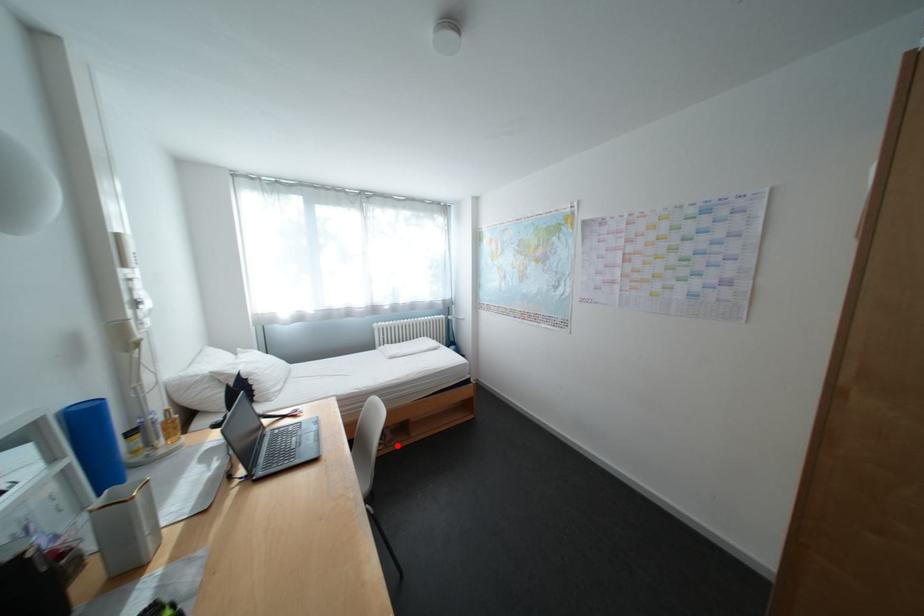
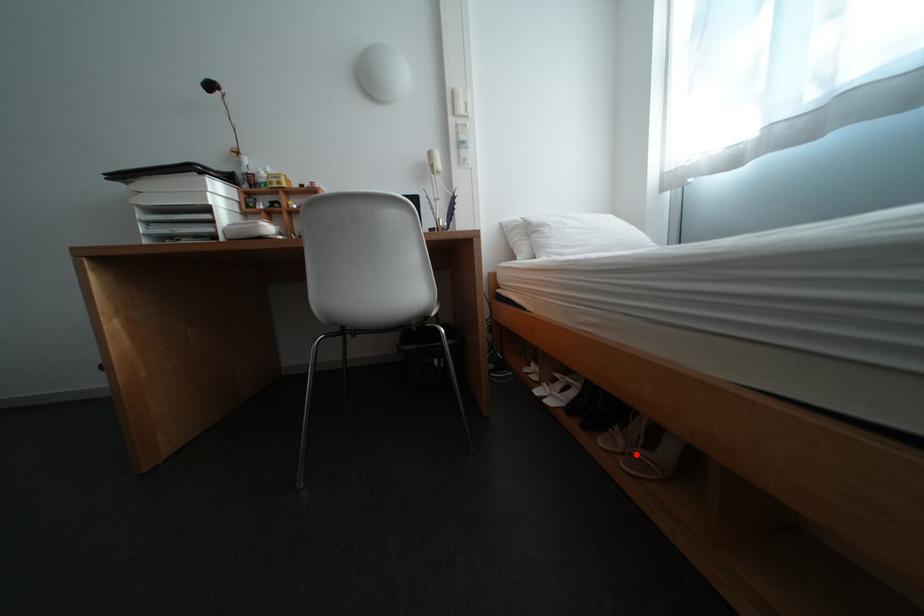
I am providing you with two images of the same scene from different viewpoints. A red point is marked on the first image and another point is marked on the second image. Do the highlighted points in image1 and image2 indicate the same real-world spot?

Yes